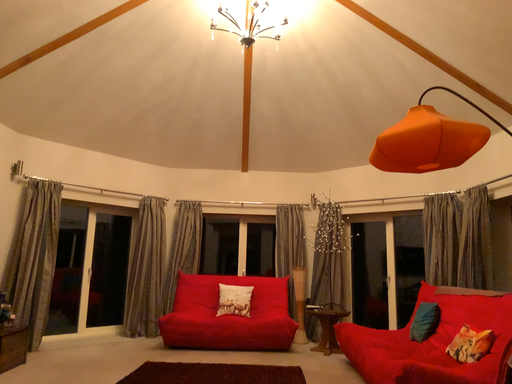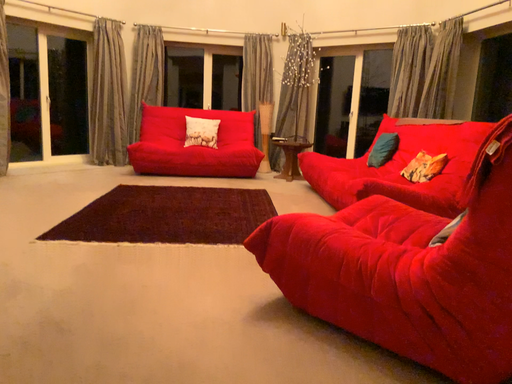
Question: Which way did the camera rotate in the video?

Choices:
 (A) rotated upward
 (B) rotated downward

Answer: (B)